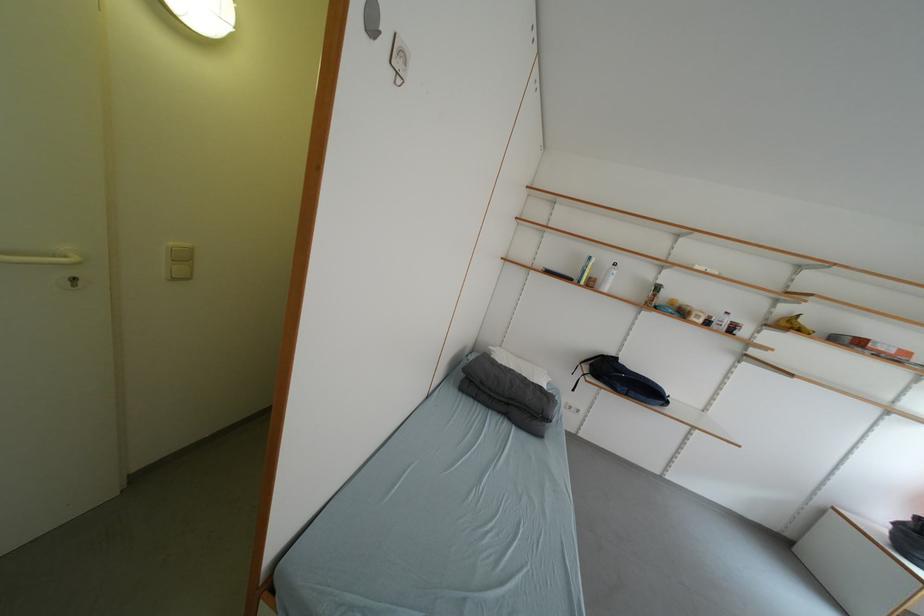
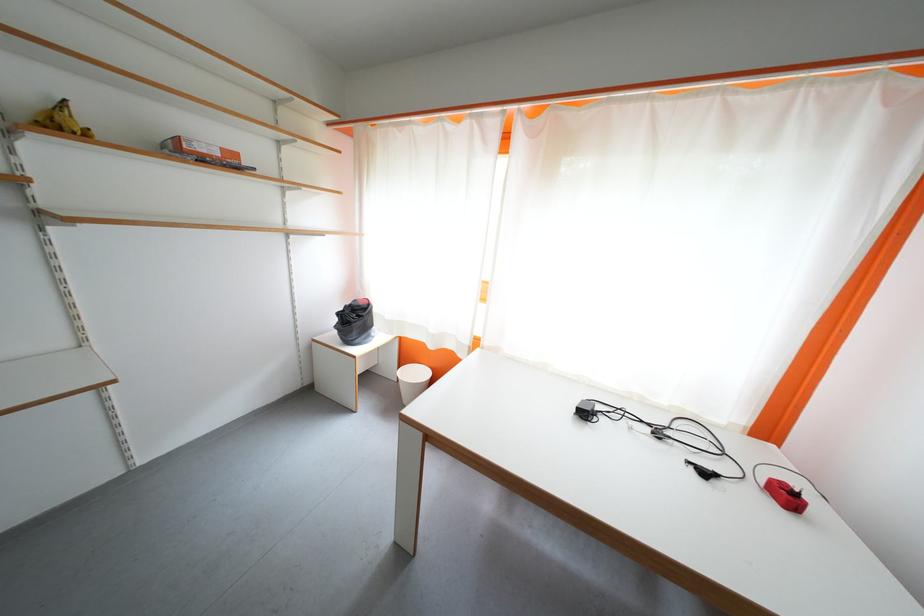
Find the pixel in the second image that matches point 797,328 in the first image.

(68, 129)